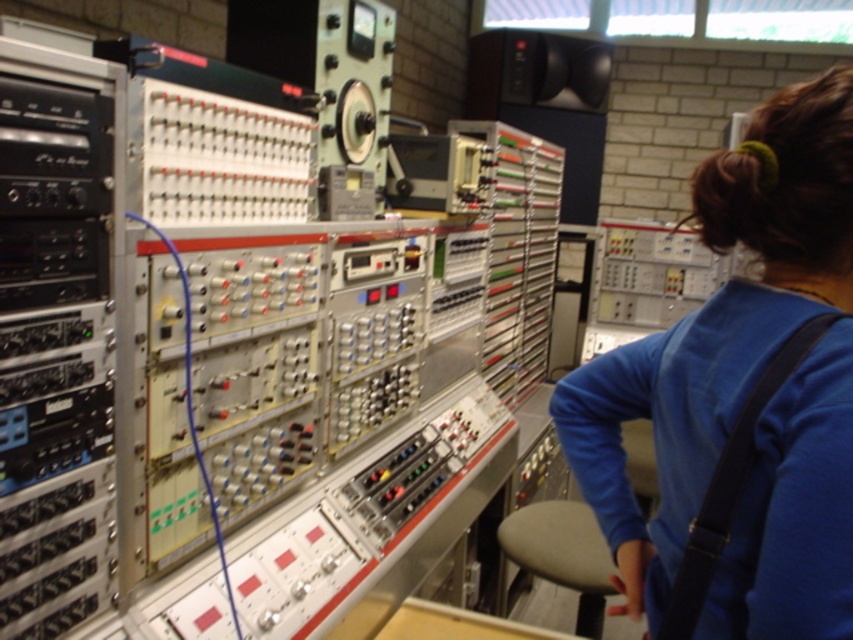
Is blue fabric shirt at center shorter than gray fabric stool at lower center?

In fact, blue fabric shirt at center may be taller than gray fabric stool at lower center.

From the picture: Between blue fabric shirt at center and gray fabric stool at lower center, which one appears on the left side from the viewer's perspective?

blue fabric shirt at center is more to the left.

Is point (811, 476) in front of point (560, 506)?

Yes.

Identify the location of blue fabric shirt at center. This screenshot has height=640, width=853. (741, 388).